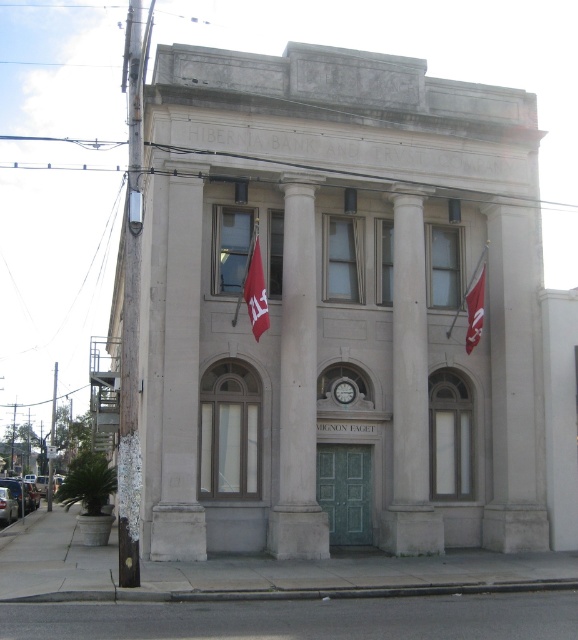
You are standing in front of the building and want to hang a new flag. The flagpole has a hook at the top. If you want to hang the flag so it is above the white smooth pillar at center, where should you place the red fabric flag at center?

The red fabric flag at center should be placed at the top of the flagpole, as the white smooth pillar at center is below the red fabric flag at center, ensuring the flag hangs above the pillar.

You are standing 20 meters away from the Hibernia Bank and Trust Company building. If you move forward 0.53 meters toward the building, will you be closer than the point marked at coordinates point (192, 180)?

The point marked at coordinates point (192, 180) is 19.47 meters away from the viewer. If you move forward 0.53 meters from your current position of 20 meters, you will be 19.47 meters away, which is exactly at the distance of the point. Therefore, you will be at the same distance as the point.